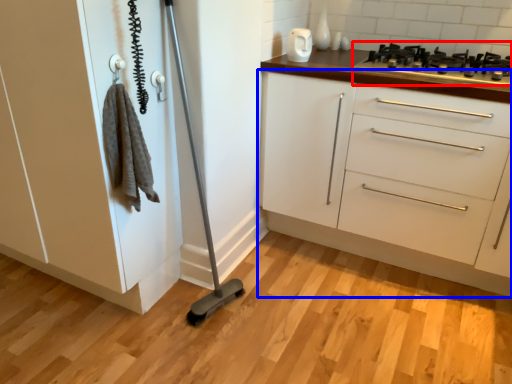
Question: Which object is further to the camera taking this photo, gas stove (highlighted by a red box) or chest of drawers (highlighted by a blue box)?

Choices:
 (A) gas stove
 (B) chest of drawers

Answer: (A)